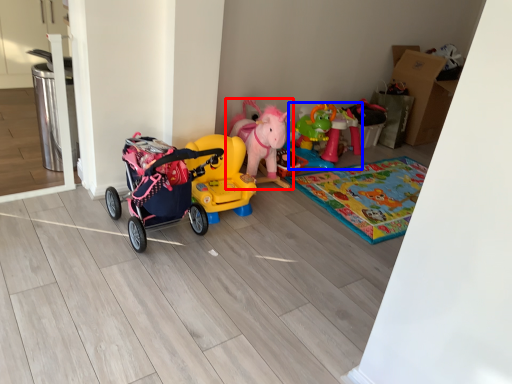
Question: Which of the following is the closest to the observer, toy (highlighted by a red box) or toy (highlighted by a blue box)?

Choices:
 (A) toy
 (B) toy

Answer: (A)